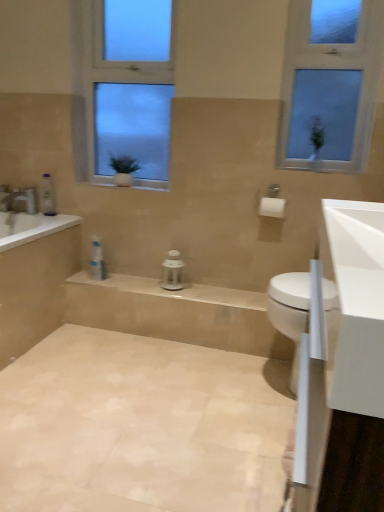
Question: Is white glossy bathtub at left far away from beige tile bath at lower left?

Choices:
 (A) no
 (B) yes

Answer: (A)

Question: From a real-world perspective, is white glossy bathtub at left located higher than beige tile bath at lower left?

Choices:
 (A) yes
 (B) no

Answer: (A)

Question: Is white glossy bathtub at left bigger than beige tile bath at lower left?

Choices:
 (A) no
 (B) yes

Answer: (A)

Question: Is the depth of white glossy bathtub at left greater than that of beige tile bath at lower left?

Choices:
 (A) yes
 (B) no

Answer: (A)

Question: From the image's perspective, is white glossy bathtub at left under beige tile bath at lower left?

Choices:
 (A) yes
 (B) no

Answer: (B)

Question: Is white matte toilet paper at upper center to the left or to the right of white plastic toiletries at center, the first toiletry in the bottom-to-top sequence, in the image?

Choices:
 (A) left
 (B) right

Answer: (B)

Question: From their relative heights in the image, would you say white matte toilet paper at upper center is taller or shorter than white plastic toiletries at center, which ranks as the second toiletry in top-to-bottom order?

Choices:
 (A) short
 (B) tall

Answer: (A)

Question: From the image's perspective, is white matte toilet paper at upper center above or below white plastic toiletries at center, positioned as the second toiletry in left-to-right order?

Choices:
 (A) above
 (B) below

Answer: (A)

Question: Considering the positions of white matte toilet paper at upper center and white plastic toiletries at center, the first toiletry in the bottom-to-top sequence, in the image, is white matte toilet paper at upper center bigger or smaller than white plastic toiletries at center, the first toiletry in the bottom-to-top sequence,?

Choices:
 (A) small
 (B) big

Answer: (A)

Question: Is point (19, 274) positioned closer to the camera than point (51, 476)?

Choices:
 (A) farther
 (B) closer

Answer: (A)

Question: Visually, is beige tile bath at lower left positioned to the left or to the right of beige tile floor at lower left?

Choices:
 (A) right
 (B) left

Answer: (B)

Question: Is beige tile bath at lower left bigger or smaller than beige tile floor at lower left?

Choices:
 (A) big
 (B) small

Answer: (A)

Question: Considering the positions of beige tile bath at lower left and beige tile floor at lower left in the image, is beige tile bath at lower left taller or shorter than beige tile floor at lower left?

Choices:
 (A) short
 (B) tall

Answer: (B)

Question: From a real-world perspective, is white matte toilet paper at upper center above or below white glossy bathtub at left?

Choices:
 (A) below
 (B) above

Answer: (B)

Question: Considering the positions of point (279, 202) and point (6, 192), is point (279, 202) closer or farther from the camera than point (6, 192)?

Choices:
 (A) farther
 (B) closer

Answer: (B)